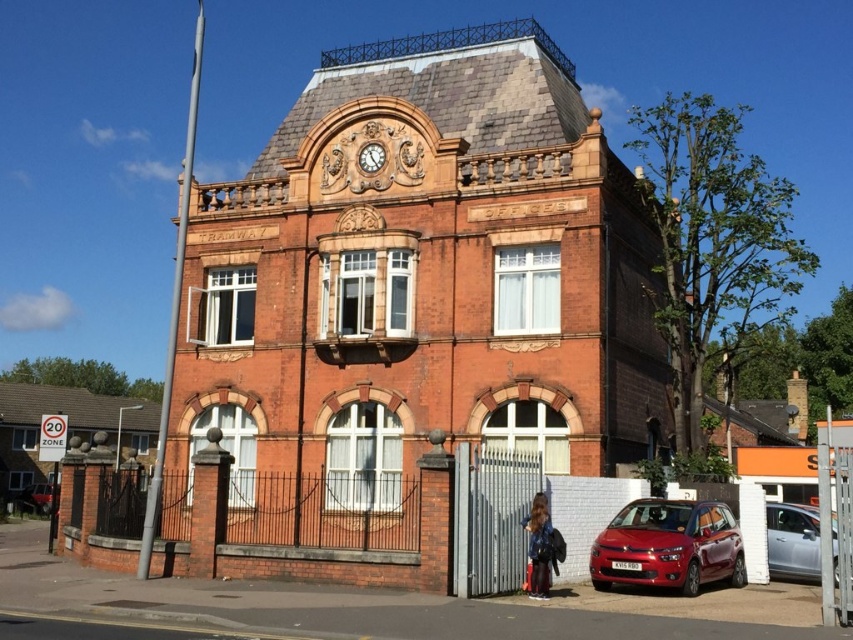
You are a delivery driver who needs to park your metallic red car at lower left in a spot that is 1 meter away from the building. The parking spot is located at point (x=36, y=499). Is the distance between your car and the building sufficient for you to open the driver side door which requires 0.8 meters of space?

The point (x=36, y=499) marks the metallic red car at lower left, so the distance between the metallic red car at lower left and the building is 1 meter. Since the driver side door requires 0.8 meters of space, the distance is sufficient to open the door.

Consider the image. You are standing in front of the two story brick building. You see a glossy metallic car at lower right and a dark brown leather jacket at lower right. Which object is closer to you?

The glossy metallic car at lower right is closer to the viewer than the dark brown leather jacket at lower right.

You are standing at the camera position and want to reach point [741,586]. Is the distance more than 30 meters?

The distance between the camera and point [741,586] is 39.22 meters, which is more than 30 meters.